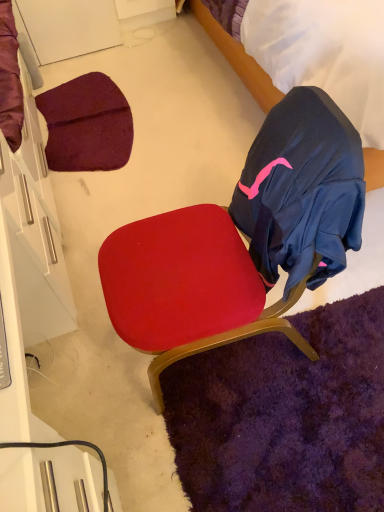
Question: Considering the positions of point (246, 266) and point (243, 58), is point (246, 266) closer or farther from the camera than point (243, 58)?

Choices:
 (A) farther
 (B) closer

Answer: (B)

Question: From a real-world perspective, is velvet red chair at center positioned above or below velvet blue bed at upper right?

Choices:
 (A) below
 (B) above

Answer: (A)

Question: In terms of height, does velvet red chair at center look taller or shorter compared to velvet blue bed at upper right?

Choices:
 (A) tall
 (B) short

Answer: (B)

Question: Is point (206, 25) closer or farther from the camera than point (301, 249)?

Choices:
 (A) farther
 (B) closer

Answer: (A)

Question: From the image's perspective, is velvet blue bed at upper right located above or below velvet red chair at center?

Choices:
 (A) below
 (B) above

Answer: (B)

Question: From a real-world perspective, is velvet blue bed at upper right positioned above or below velvet red chair at center?

Choices:
 (A) below
 (B) above

Answer: (B)

Question: Is velvet blue bed at upper right taller or shorter than velvet red chair at center?

Choices:
 (A) tall
 (B) short

Answer: (A)